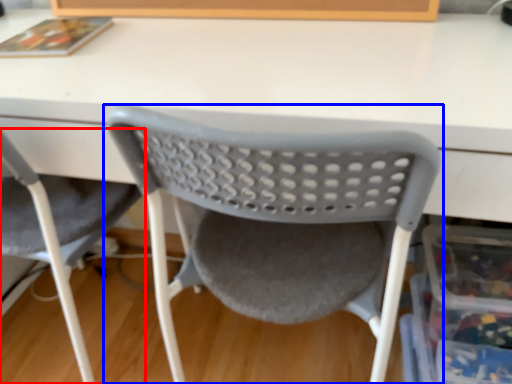
Question: Which object is further to the camera taking this photo, chair (highlighted by a red box) or chair (highlighted by a blue box)?

Choices:
 (A) chair
 (B) chair

Answer: (A)